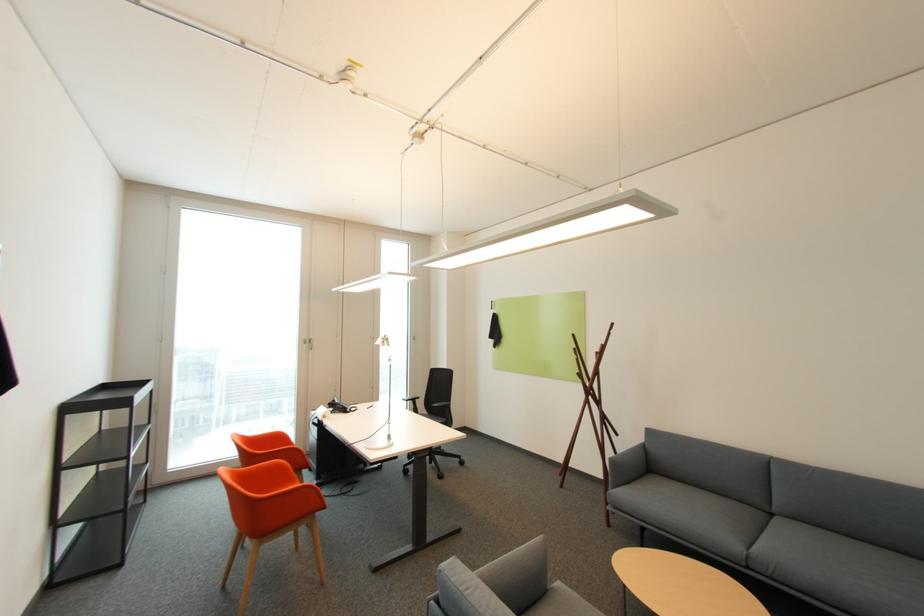
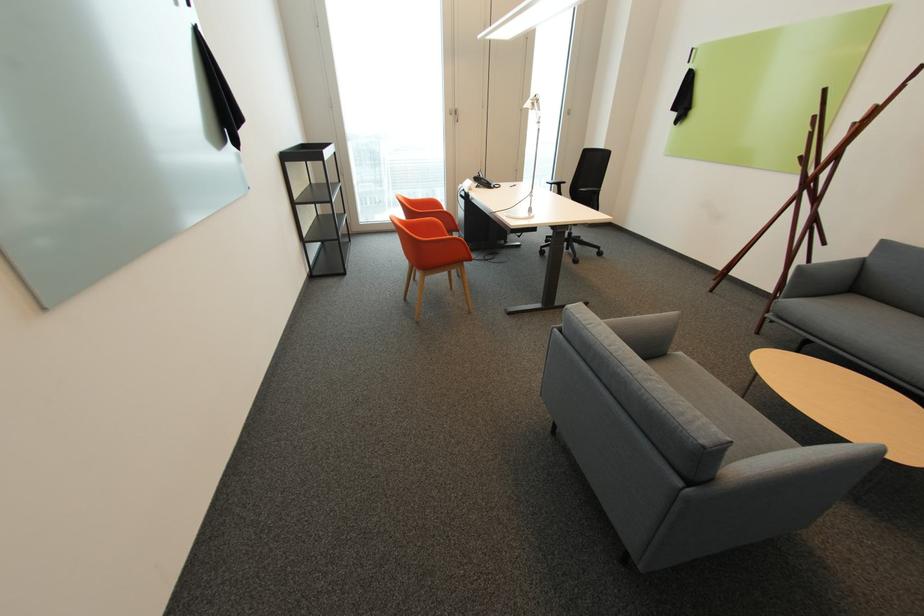
Find the pixel in the second image that matches (285,438) in the first image.

(440, 205)